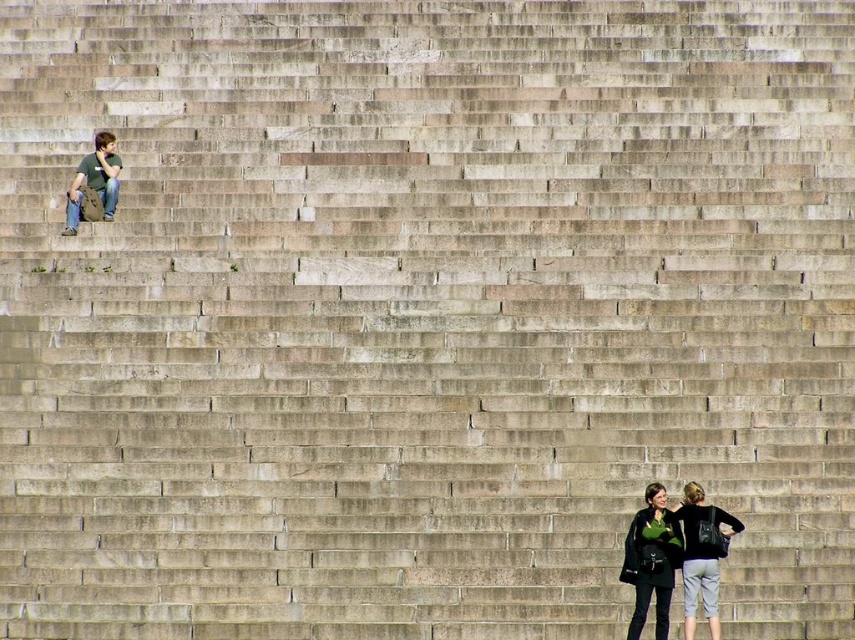
You are standing on the dam structure and notice two green items. One is the green fabric jacket at lower right and the other is the matte green shirt at upper left. Which of these items is located lower on the dam structure?

The green fabric jacket at lower right is positioned under the matte green shirt at upper left, meaning it is located lower on the dam structure.

You are standing at the base of the concrete structure and see the green fabric jacket at lower right and the matte green shirt at upper left. Which item is farther from your current position?

The green fabric jacket at lower right is 14.06 meters away from the matte green shirt at upper left. Since you are at the base, the matte green shirt at upper left is farther away from your current position because it is located higher up on the sloping structure.